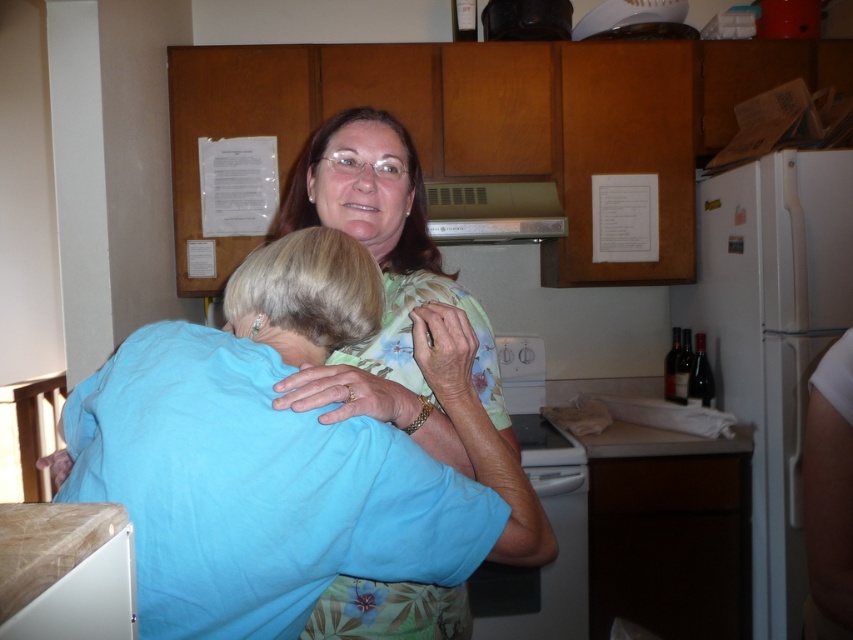
Can you confirm if light blue fabric shirt at center is thinner than white glossy dishwasher at center?

In fact, light blue fabric shirt at center might be wider than white glossy dishwasher at center.

Is light blue fabric shirt at center below white glossy dishwasher at center?

Actually, light blue fabric shirt at center is above white glossy dishwasher at center.

Between point (271, 582) and point (479, 618), which one is positioned in front?

Positioned in front is point (271, 582).

Identify the location of light blue fabric shirt at center. This screenshot has width=853, height=640. (318, 464).

Where is `light blue fabric shirt at center`? The width and height of the screenshot is (853, 640). light blue fabric shirt at center is located at coordinates (318, 464).

Which is behind, point (225, 545) or point (395, 266)?

Point (395, 266)

Describe the element at coordinates (318, 464) in the screenshot. I see `light blue fabric shirt at center` at that location.

I want to click on light blue fabric shirt at center, so click(x=318, y=464).

Which is in front, point (450, 428) or point (521, 348)?

Point (450, 428)

Is floral print blouse at center positioned before white glossy dishwasher at center?

Yes, it is.

Is point (424, 614) behind point (573, 608)?

That is False.

In order to click on floral print blouse at center in this screenshot , I will do `click(384, 284)`.